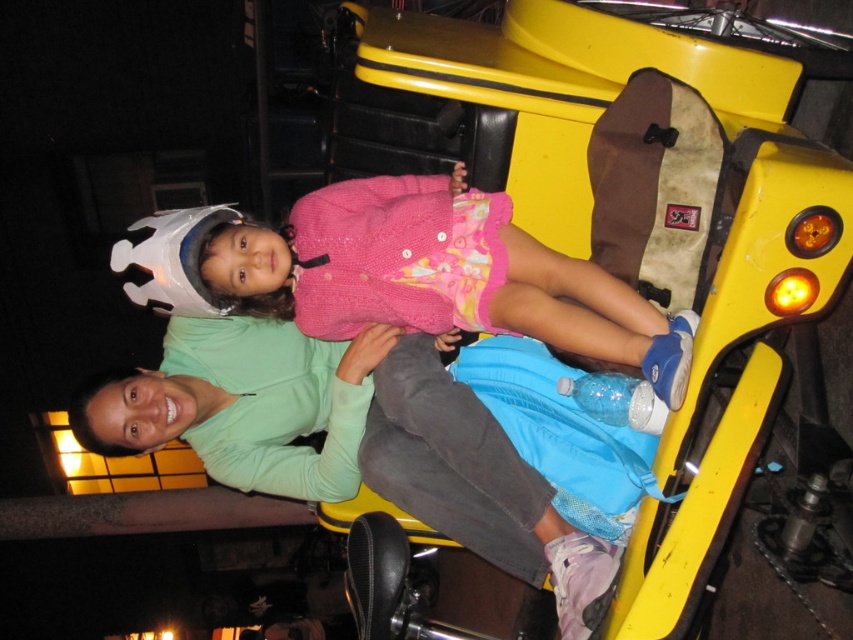
Question: Among these points, which one is nearest to the camera?

Choices:
 (A) (509, 250)
 (B) (277, 400)

Answer: (A)

Question: Observing the image, what is the correct spatial positioning of green matte jacket at center in reference to pink knitted sweater at center?

Choices:
 (A) left
 (B) right

Answer: (A)

Question: Considering the relative positions of green matte jacket at center and pink knitted sweater at center in the image provided, where is green matte jacket at center located with respect to pink knitted sweater at center?

Choices:
 (A) below
 (B) above

Answer: (A)

Question: Which of the following is the farthest from the observer?

Choices:
 (A) green matte jacket at center
 (B) pink knitted sweater at center

Answer: (A)

Question: Which of the following is the farthest from the observer?

Choices:
 (A) pink knitted sweater at center
 (B) green matte jacket at center

Answer: (B)

Question: In this image, where is green matte jacket at center located relative to pink knitted sweater at center?

Choices:
 (A) above
 (B) below

Answer: (B)